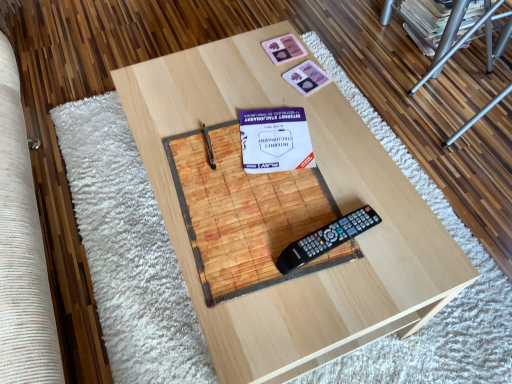
Where is `free area in between black plastic remote control at center and pink matte coaster at upper center, arranged as the 1th square when viewed from the top`? Image resolution: width=512 pixels, height=384 pixels. free area in between black plastic remote control at center and pink matte coaster at upper center, arranged as the 1th square when viewed from the top is located at coordinates (306, 153).